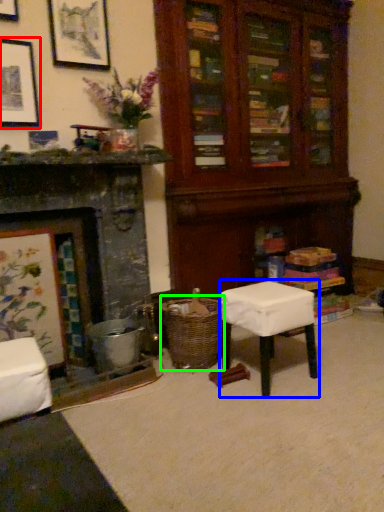
Question: Estimate the real-world distances between objects in this image. Which object is closer to picture frame (highlighted by a red box), stool (highlighted by a blue box) or crate (highlighted by a green box)?

Choices:
 (A) stool
 (B) crate

Answer: (B)